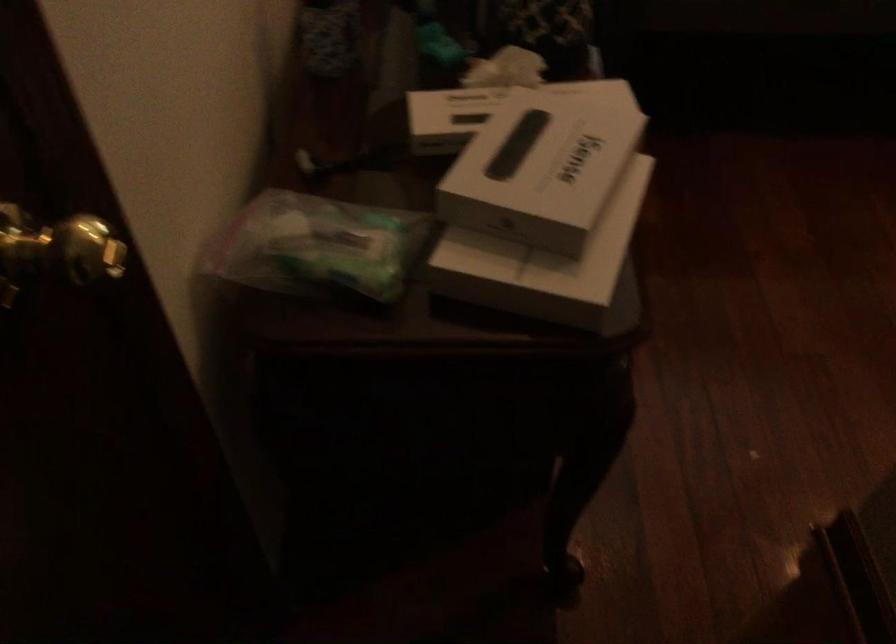
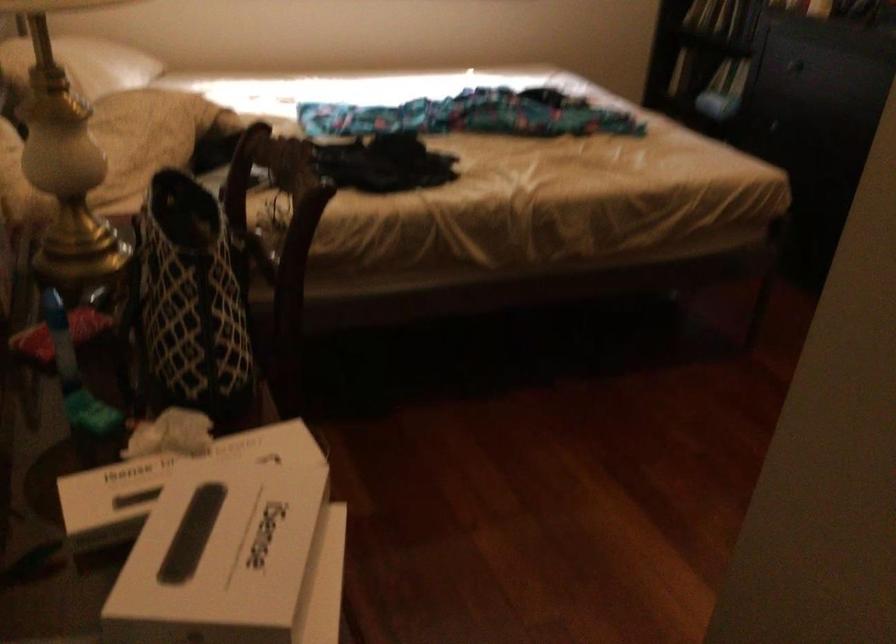
The point at [543,171] is marked in the first image. Where is the corresponding point in the second image?

(234, 560)